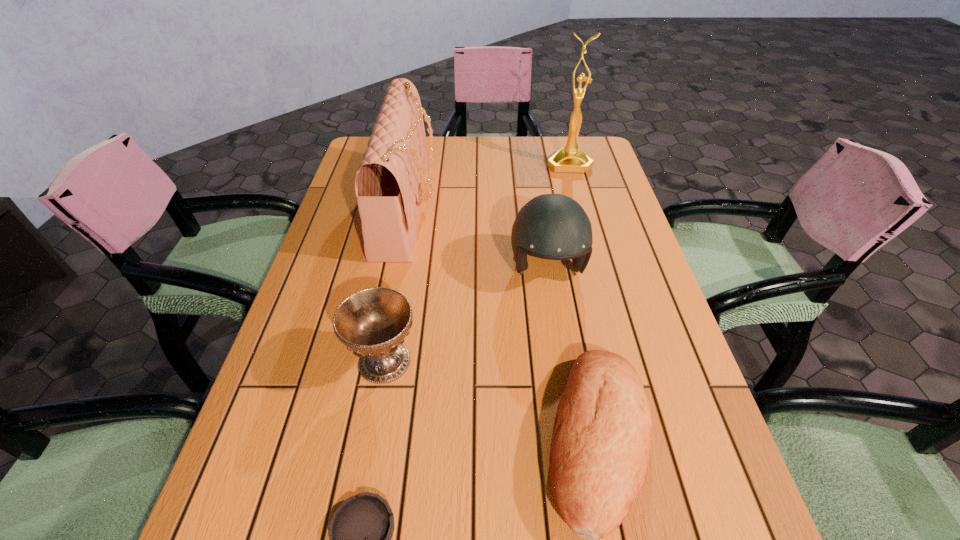
Locate an element on the screen. Image resolution: width=960 pixels, height=540 pixels. empty location between the third tallest object and the fifth shortest object is located at coordinates (478, 239).

At what (x,y) coordinates should I click in order to perform the action: click on vacant area that lies between the third shortest object and the second tallest object. Please return your answer as a coordinate pair (x, y). Looking at the image, I should click on (396, 285).

The image size is (960, 540). What are the coordinates of `free space that is in between the fourth tallest object and the third tallest object` in the screenshot? It's located at 466,315.

Locate an element on the screen. This screenshot has height=540, width=960. empty space that is in between the chalice and the football helmet is located at coordinates (466, 315).

At what (x,y) coordinates should I click in order to perform the action: click on object that is the fifth closest one to the chalice. Please return your answer as a coordinate pair (x, y). This screenshot has height=540, width=960. Looking at the image, I should click on (569, 158).

Locate which object ranks fourth in proximity to the handbag. Please provide its 2D coordinates. Your answer should be formatted as a tuple, i.e. [(x, y)], where the tuple contains the x and y coordinates of a point satisfying the conditions above.

[(599, 454)]